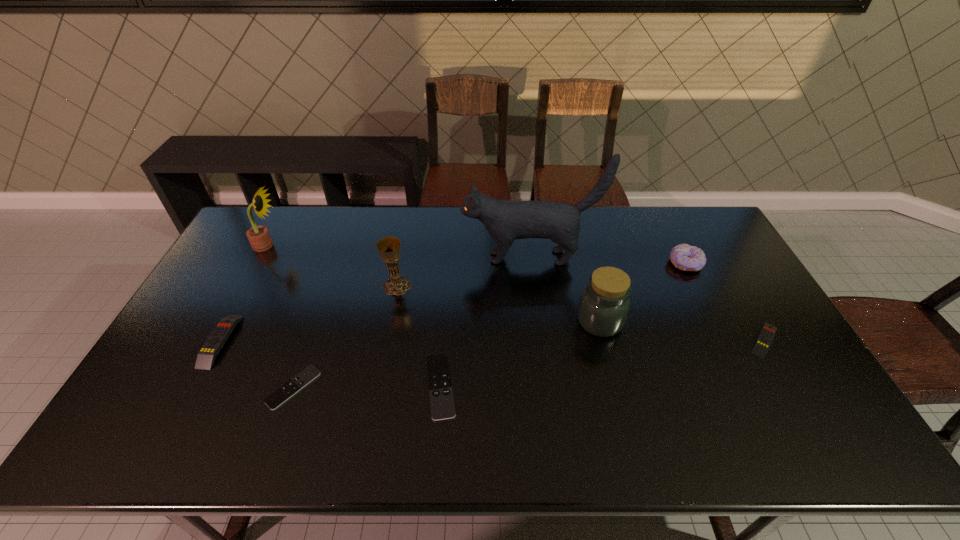
You are a GUI agent. You are given a task and a screenshot of the screen. Output one action in this format:
    pyautogui.click(x=<x>, y=<y>)
    Task: Click on the free space located on the face of the yellow sunflower
    
    Given the screenshot: What is the action you would take?
    pyautogui.click(x=349, y=246)

Locate an element on the screen. The width and height of the screenshot is (960, 540). vacant space positioned on the right of the gold chalice is located at coordinates (468, 286).

The width and height of the screenshot is (960, 540). Identify the location of free space located on the right of the green jar. (739, 321).

Identify the location of free space located on the right of the brown doughnut. The image size is (960, 540). (717, 264).

Where is `blank space located on the back of the bigger yellow remote control`? This screenshot has width=960, height=540. blank space located on the back of the bigger yellow remote control is located at coordinates (258, 269).

Where is `blank space located on the back of the rightmost remote control`? Image resolution: width=960 pixels, height=540 pixels. blank space located on the back of the rightmost remote control is located at coordinates (739, 297).

The width and height of the screenshot is (960, 540). Find the location of `free space located on the right of the right black remote control`. free space located on the right of the right black remote control is located at coordinates (573, 387).

The width and height of the screenshot is (960, 540). Find the location of `vacant area situated on the left of the smaller black remote control`. vacant area situated on the left of the smaller black remote control is located at coordinates (220, 388).

You are a GUI agent. You are given a task and a screenshot of the screen. Output one action in this format:
    pyautogui.click(x=<x>, y=<y>)
    Task: Click on the object at the far edge
    Image resolution: width=960 pixels, height=540 pixels.
    Given the screenshot: What is the action you would take?
    pyautogui.click(x=258, y=236)

At what (x,y) coordinates should I click in order to perform the action: click on object that is at the near edge. Please return your answer as a coordinate pair (x, y). The width and height of the screenshot is (960, 540). Looking at the image, I should click on (442, 405).